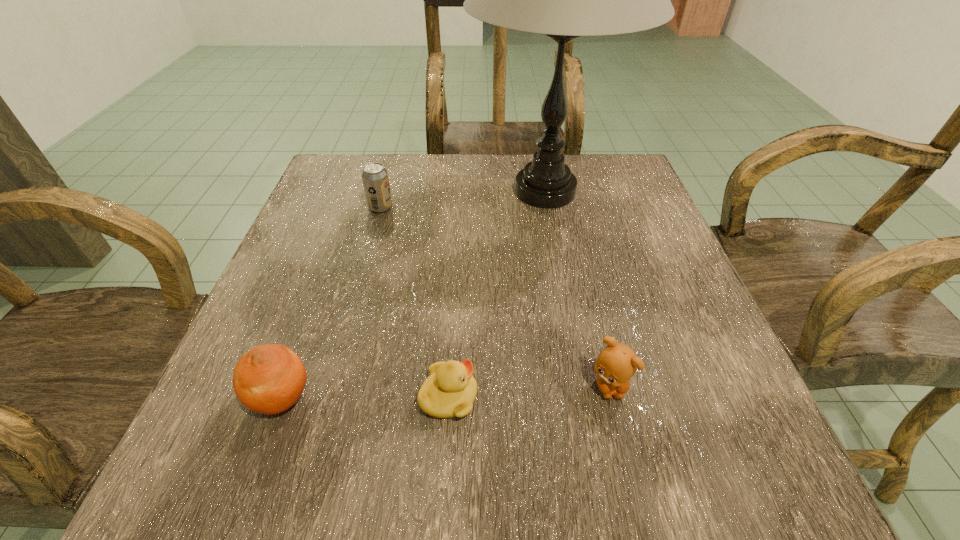
Image resolution: width=960 pixels, height=540 pixels. In the image, there is a desktop. Find the location of `free space at the far right corner`. free space at the far right corner is located at coordinates (601, 188).

The image size is (960, 540). I want to click on free spot at the near right corner of the desktop, so click(752, 492).

Identify the location of unoccupied position between the beer can and the teddy bear. (494, 296).

Where is `free area in between the shortest object and the tallest object`? free area in between the shortest object and the tallest object is located at coordinates pyautogui.click(x=496, y=294).

This screenshot has width=960, height=540. What are the coordinates of `free area in between the beer can and the duckling` in the screenshot? It's located at (415, 302).

Locate an element on the screen. This screenshot has height=540, width=960. unoccupied position between the lamp and the duckling is located at coordinates (496, 294).

Locate an element on the screen. This screenshot has width=960, height=540. vacant space that is in between the shortest object and the teddy bear is located at coordinates (529, 392).

This screenshot has width=960, height=540. In order to click on unoccupied area between the beer can and the orange in this screenshot , I will do `click(331, 303)`.

At what (x,y) coordinates should I click in order to perform the action: click on empty location between the teddy bear and the beer can. Please return your answer as a coordinate pair (x, y). Looking at the image, I should click on pos(494,296).

Image resolution: width=960 pixels, height=540 pixels. Identify the location of vacant space in between the lamp and the orange. (413, 295).